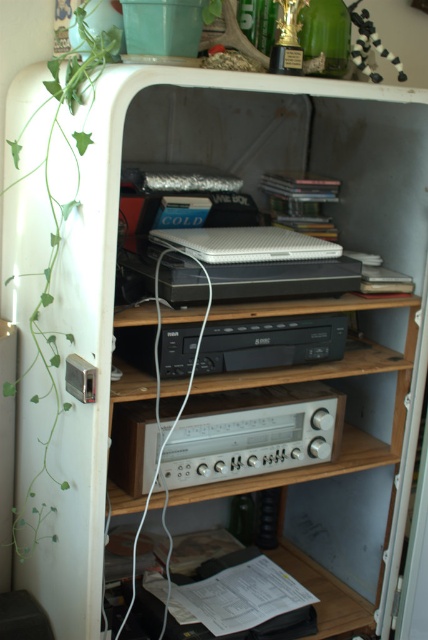
Between green leafy plant at left and black plastic stereo at center, which one appears on the left side from the viewer's perspective?

Positioned to the left is green leafy plant at left.

Locate an element on the screen. Image resolution: width=428 pixels, height=640 pixels. green leafy plant at left is located at coordinates (59, 200).

Can you confirm if silver metallic stereo at center is shorter than black plastic stereo at center?

In fact, silver metallic stereo at center may be taller than black plastic stereo at center.

Does silver metallic stereo at center appear on the left side of black plastic stereo at center?

Indeed, silver metallic stereo at center is positioned on the left side of black plastic stereo at center.

Image resolution: width=428 pixels, height=640 pixels. What do you see at coordinates (252, 433) in the screenshot? I see `silver metallic stereo at center` at bounding box center [252, 433].

At what (x,y) coordinates should I click in order to perform the action: click on silver metallic stereo at center. Please return your answer as a coordinate pair (x, y). The width and height of the screenshot is (428, 640). Looking at the image, I should click on (252, 433).

Does silver metallic stereo at center appear on the left side of green leafy plant at left?

Incorrect, silver metallic stereo at center is not on the left side of green leafy plant at left.

Does point (261, 404) come in front of point (29, 323)?

No, (261, 404) is behind (29, 323).

Is point (284, 388) closer to viewer compared to point (9, 385)?

No.

Locate an element on the screen. Image resolution: width=428 pixels, height=640 pixels. silver metallic stereo at center is located at coordinates (252, 433).